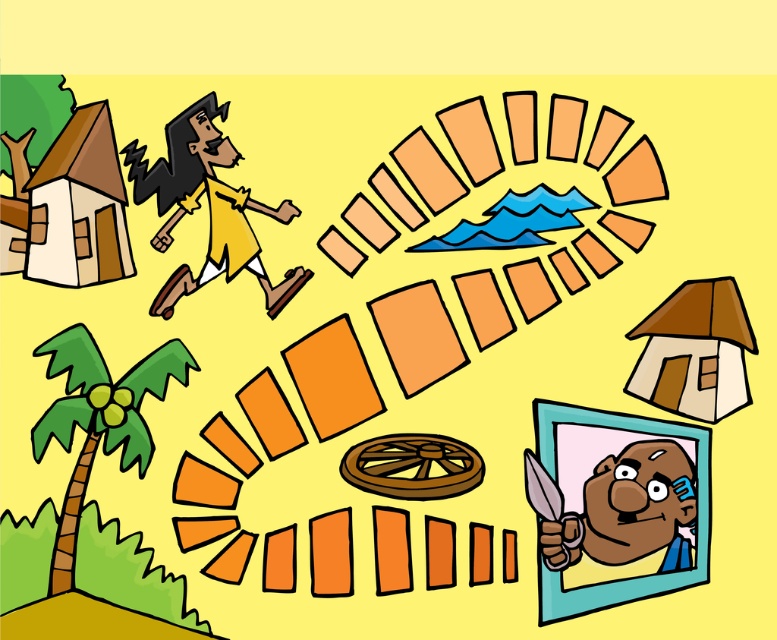
Can you confirm if smooth brown frame at lower right is thinner than yellow matte/yellowish skin at upper left?

Indeed, smooth brown frame at lower right has a lesser width compared to yellow matte/yellowish skin at upper left.

Between point (584, 566) and point (186, 291), which one is positioned behind?

Positioned behind is point (186, 291).

I want to click on smooth brown frame at lower right, so click(615, 506).

I want to click on smooth brown frame at lower right, so click(x=615, y=506).